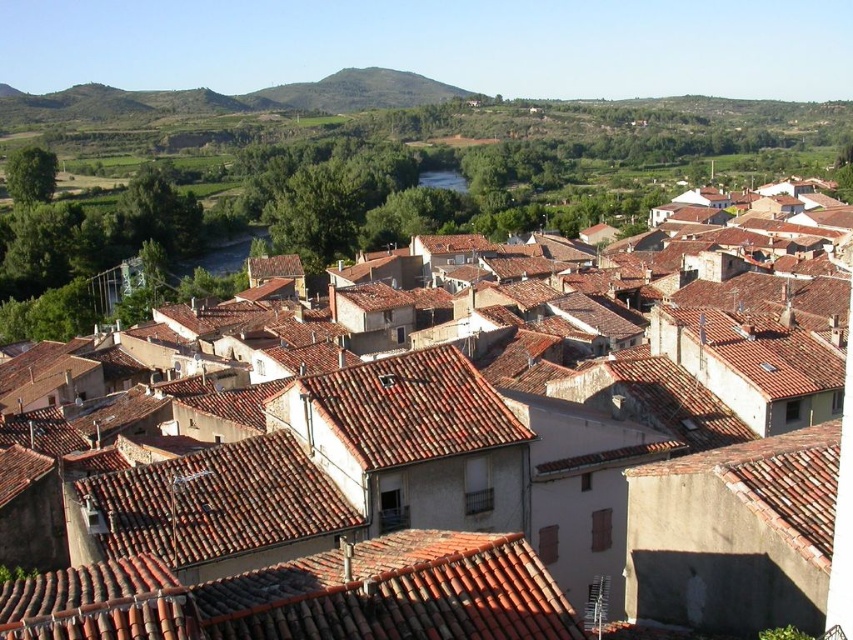
You are standing at the camera position and want to throw a ball to the point marked as point (x=436, y=406). If the ball can travel up to 30 meters, will it reach the point?

The distance of point (x=436, y=406) from camera is 33.99 meters, so the ball cannot reach it since it requires traveling 33.99 meters, exceeding the ball travel limit of 30 meters.

You are an architect analyzing the village layout. You observe the brown tile roofs at center and the brown tile roof at center. Which of these two has a higher elevation in the image?

The brown tile roofs at center is positioned over brown tile roof at center, indicating it has a higher elevation.

You are standing at the point marked by the coordinates point (310, 596). What is the primary material of the surface you are standing on?

The point (310, 596) marks red clay tiles at center, so the primary material is red clay tiles.